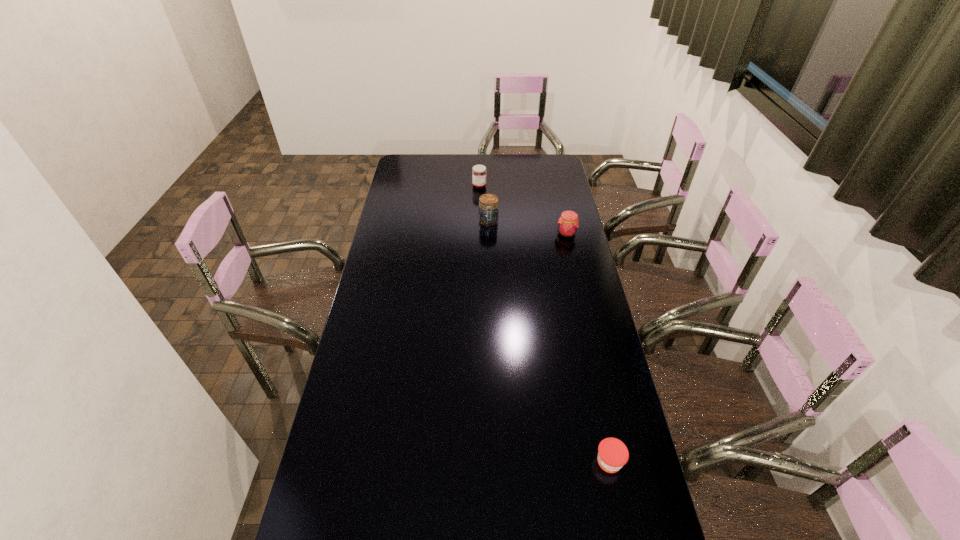
Find the location of a particular element. free space between the jar and the second nearest jam is located at coordinates (527, 227).

Identify which object is the third nearest to the leftmost jam. Please provide its 2D coordinates. Your answer should be formatted as a tuple, i.e. [(x, y)], where the tuple contains the x and y coordinates of a point satisfying the conditions above.

[(612, 453)]

Where is `object that is the closest to the second farthest jam`? object that is the closest to the second farthest jam is located at coordinates (488, 213).

Image resolution: width=960 pixels, height=540 pixels. Find the location of `jam object that ranks as the closest to the tallest object`. jam object that ranks as the closest to the tallest object is located at coordinates (479, 172).

Choose which jam is the nearest neighbor to the jar. Please provide its 2D coordinates. Your answer should be formatted as a tuple, i.e. [(x, y)], where the tuple contains the x and y coordinates of a point satisfying the conditions above.

[(479, 172)]

Locate an element on the screen. Image resolution: width=960 pixels, height=540 pixels. vacant point that satisfies the following two spatial constraints: 1. on the lid of the second nearest jam; 2. on the left side of the tallest object is located at coordinates (489, 233).

You are a GUI agent. You are given a task and a screenshot of the screen. Output one action in this format:
    pyautogui.click(x=<x>, y=<y>)
    Task: Click on the free space that satisfies the following two spatial constraints: 1. on the front side of the second farthest jam; 2. on the right side of the leftmost jam
    The height and width of the screenshot is (540, 960).
    Given the screenshot: What is the action you would take?
    pyautogui.click(x=479, y=233)